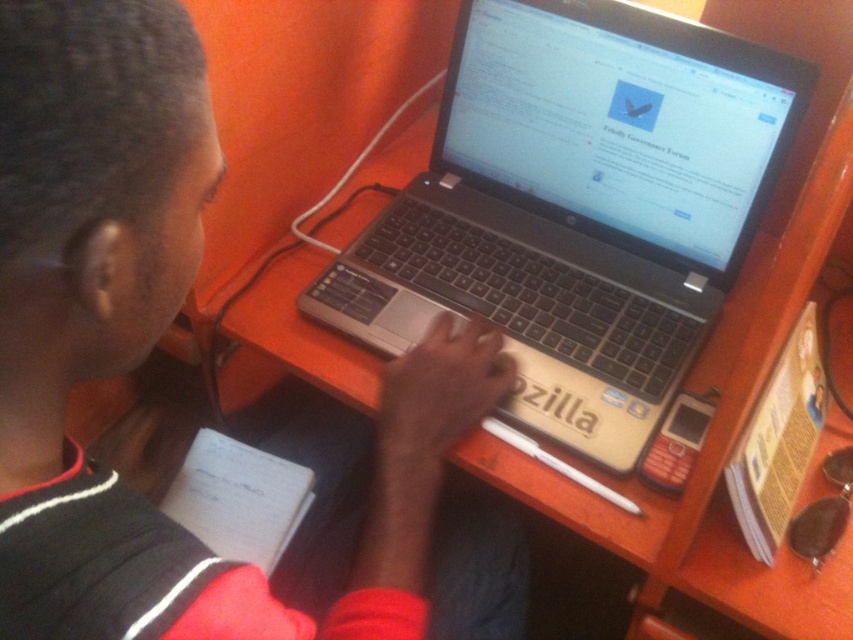
Between point (431, 449) and point (611, 44), which one is positioned behind?

Positioned behind is point (611, 44).

Who is more forward, [390,499] or [322,280]?

Positioned in front is point [390,499].

You are a GUI agent. You are given a task and a screenshot of the screen. Output one action in this format:
    pyautogui.click(x=<x>, y=<y>)
    Task: Click on the black matte laptop at center
    The height and width of the screenshot is (640, 853).
    Given the screenshot: What is the action you would take?
    pyautogui.click(x=151, y=348)